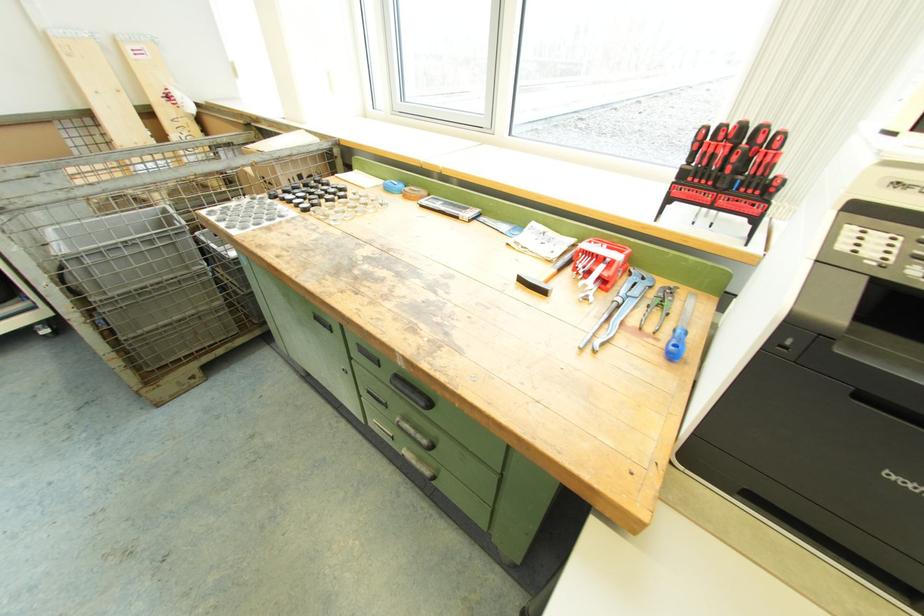
At what (x,y) coordinates should I click in order to perform the action: click on printer paper drawer. Please return your answer as a coordinate pair (x, y). This screenshot has width=924, height=616. Looking at the image, I should click on (888, 407).